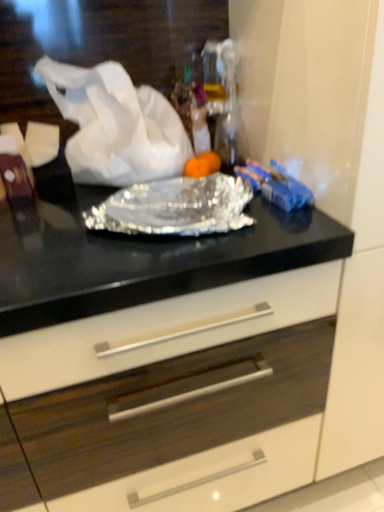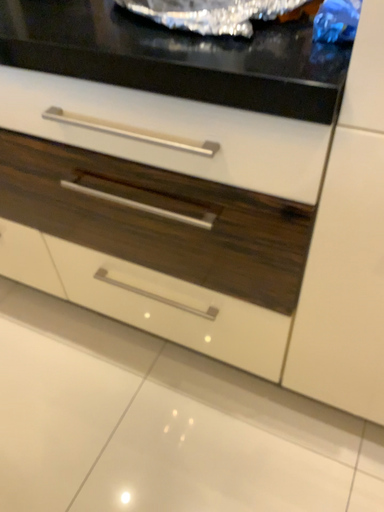
Question: How did the camera likely rotate when shooting the video?

Choices:
 (A) rotated left
 (B) rotated right

Answer: (A)